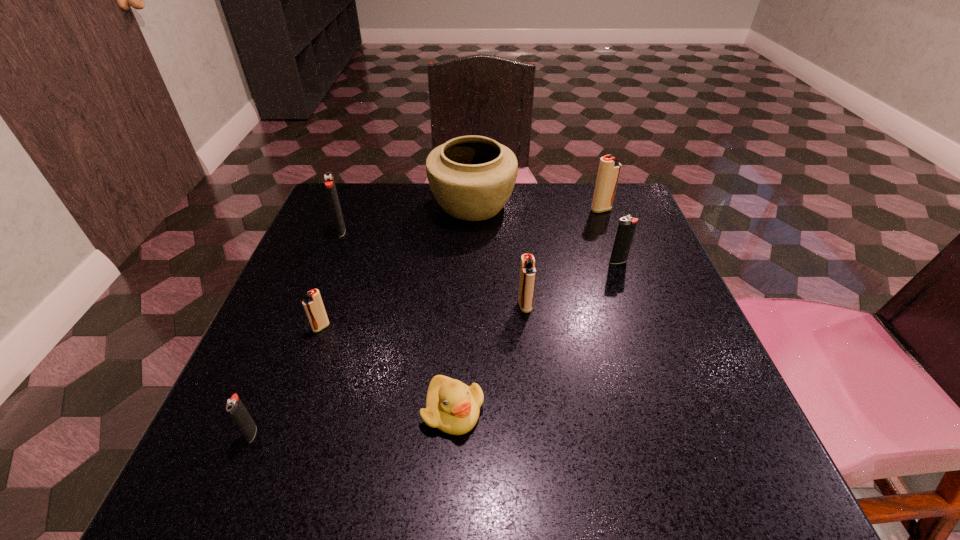
Identify the location of the leftmost red igniter. (313, 305).

This screenshot has height=540, width=960. I want to click on the smallest black igniter, so click(235, 408).

In order to click on the nearest igniter in this screenshot , I will do `click(235, 408)`.

Locate an element on the screen. the shortest object is located at coordinates (453, 407).

In order to click on duckling in this screenshot , I will do `click(453, 407)`.

The image size is (960, 540). Find the location of `vacant region located on the front of the pottery`. vacant region located on the front of the pottery is located at coordinates (471, 269).

The image size is (960, 540). I want to click on vacant area located 0.210m on the left of the rightmost red igniter, so click(508, 210).

I want to click on vacant space located on the back of the farthest black igniter, so click(360, 183).

At what (x,y) coordinates should I click in order to perform the action: click on vacant space located 0.100m on the back of the second farthest black igniter. Please return your answer as a coordinate pair (x, y). Looking at the image, I should click on (608, 232).

Where is `vacant space located 0.250m on the left of the fourth nearest object`? The width and height of the screenshot is (960, 540). vacant space located 0.250m on the left of the fourth nearest object is located at coordinates (392, 306).